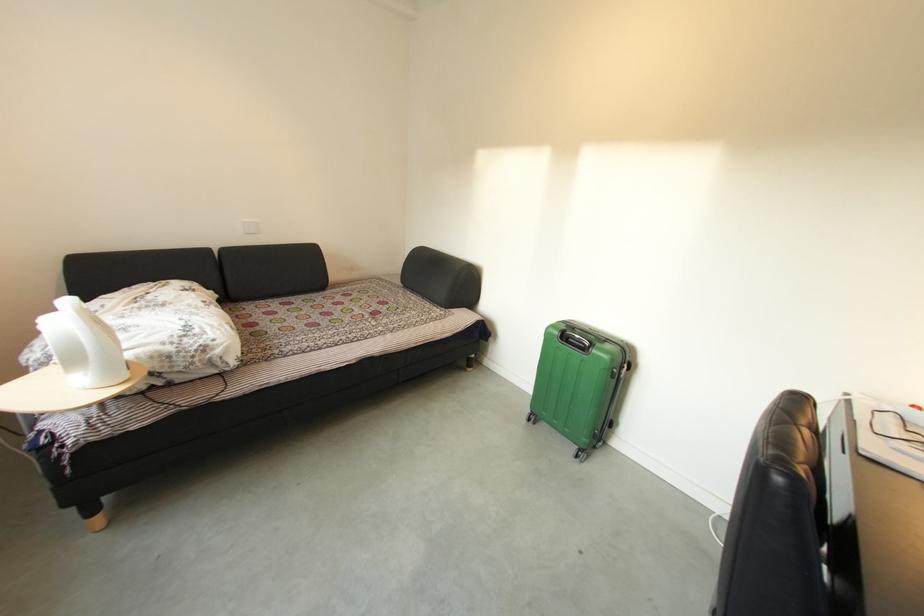
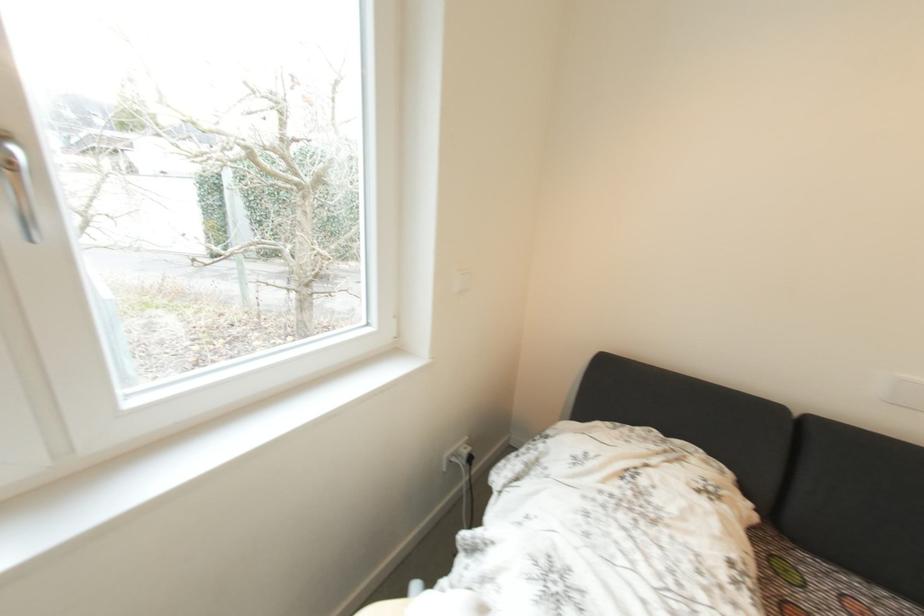
In the second image, find the point that corresponds to pixel 257 306 in the first image.

(820, 561)